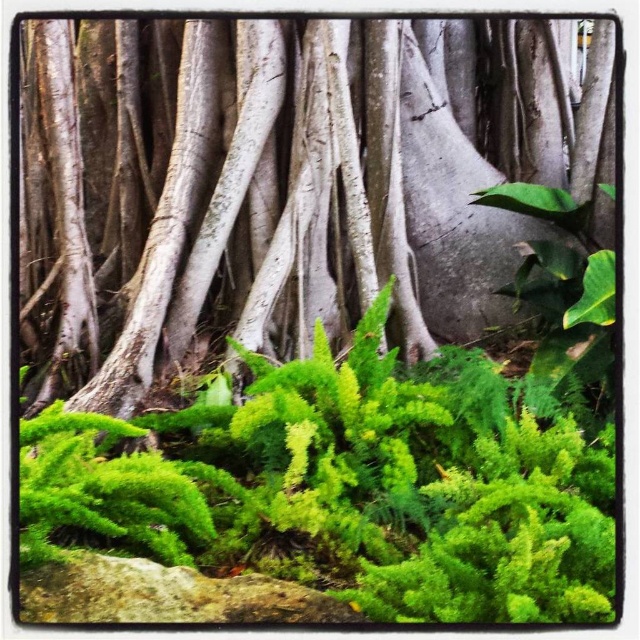
You are standing in the natural setting shown in the image. You notice two points marked in the scene. Point A is at coordinate point [124,243] and Point B is at coordinate point [168,593]. Which point is closer to you?

Point B at point [168,593] is closer to you because point [124,243] is behind point [168,593].

You are standing in the natural setting shown in the image. You notice a smooth gray bark at center. Can you tell me the exact coordinates where it is located?

The smooth gray bark at center is located at coordinates point (288,182).